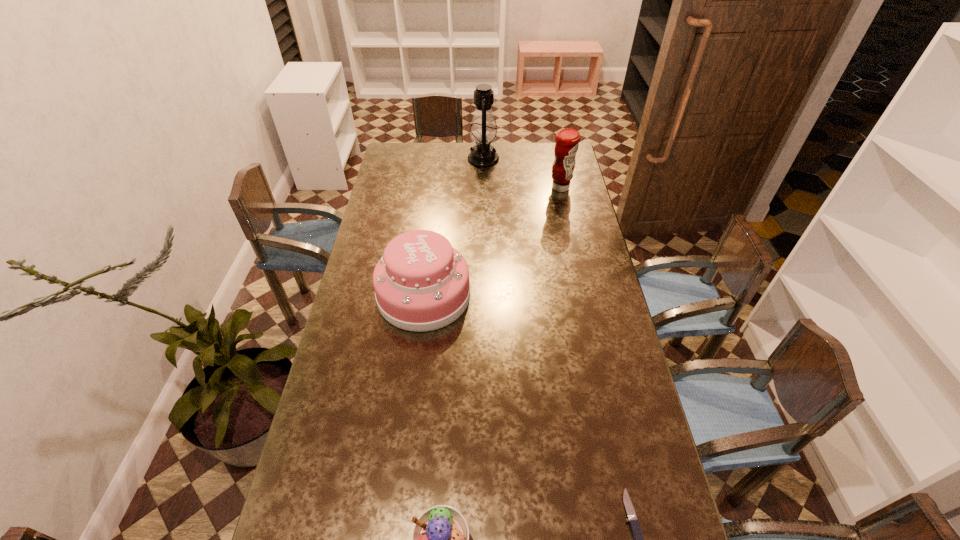
In order to click on object located at the left edge in this screenshot , I will do `click(421, 283)`.

You are a GUI agent. You are given a task and a screenshot of the screen. Output one action in this format:
    pyautogui.click(x=<x>, y=<y>)
    Task: Click on the object located at the right edge
    The width and height of the screenshot is (960, 540).
    Given the screenshot: What is the action you would take?
    pyautogui.click(x=567, y=140)

This screenshot has height=540, width=960. In the image, there is a desktop. What are the coordinates of `free space at the far edge` in the screenshot? It's located at click(530, 166).

At what (x,y) coordinates should I click in order to perform the action: click on vacant region at the left edge of the desktop. Please return your answer as a coordinate pair (x, y). Looking at the image, I should click on (308, 523).

The height and width of the screenshot is (540, 960). In the image, there is a desktop. In order to click on vacant space at the right edge in this screenshot , I will do `click(598, 258)`.

Identify the location of free space at the far left corner of the desktop. This screenshot has height=540, width=960. (396, 153).

I want to click on vacant space at the far right corner of the desktop, so click(x=551, y=149).

I want to click on empty space that is in between the third tallest object and the farthest object, so click(454, 227).

Locate an element on the screen. empty location between the third farthest object and the tallest object is located at coordinates (454, 227).

Where is `blank region between the second farthest object and the oil lamp`? blank region between the second farthest object and the oil lamp is located at coordinates (522, 173).